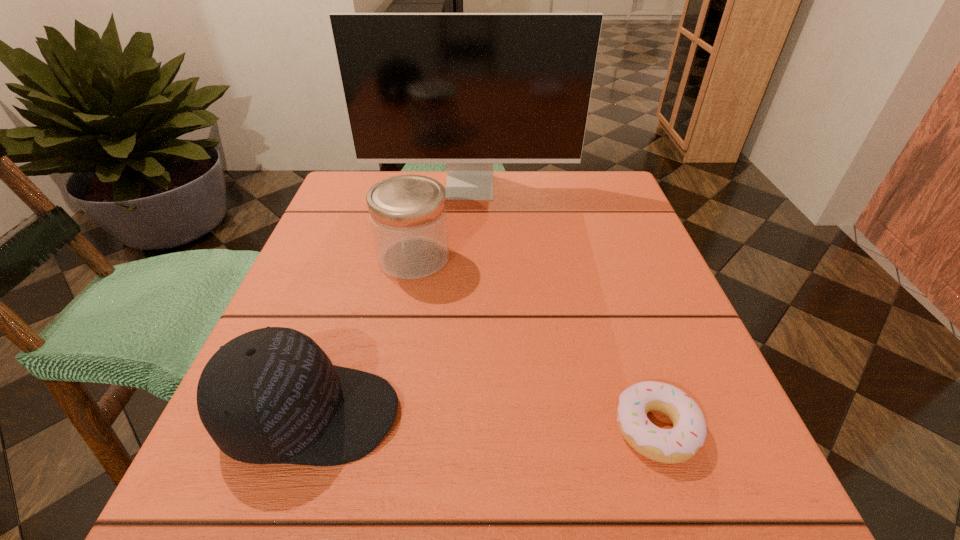
Where is `the tallest object`? This screenshot has height=540, width=960. the tallest object is located at coordinates (467, 89).

Locate an element on the screen. the farthest object is located at coordinates coord(467,89).

I want to click on the third nearest object, so (408, 216).

Image resolution: width=960 pixels, height=540 pixels. In order to click on baseball cap in this screenshot , I will do `click(270, 396)`.

You are a GUI agent. You are given a task and a screenshot of the screen. Output one action in this format:
    pyautogui.click(x=<x>, y=<y>)
    Task: Click on the shortest object
    The width and height of the screenshot is (960, 540).
    Given the screenshot: What is the action you would take?
    pyautogui.click(x=679, y=444)

The height and width of the screenshot is (540, 960). I want to click on free spot located on the front-facing side of the monitor, so click(468, 219).

Identify the location of free space located 0.330m on the front of the jar. (379, 449).

At what (x,y) coordinates should I click in order to perform the action: click on free spot located at the front of the baseball cap where the brim is located. Please return your answer as a coordinate pair (x, y). Looking at the image, I should click on (649, 415).

At what (x,y) coordinates should I click in order to perform the action: click on free space located on the front of the shortest object. Please return your answer as a coordinate pair (x, y). Looking at the image, I should click on (688, 529).

Locate an element on the screen. This screenshot has width=960, height=540. object at the far edge is located at coordinates click(467, 89).